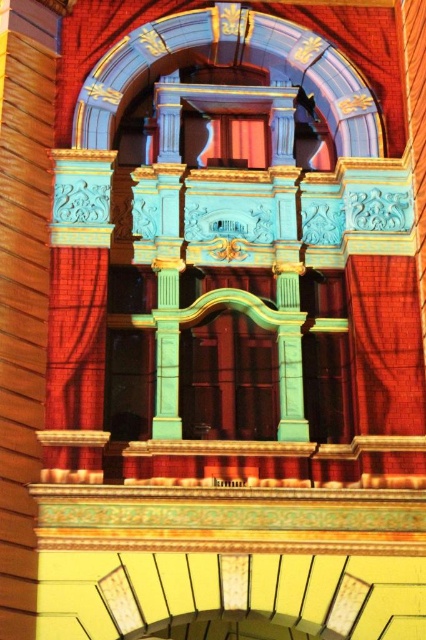
Is velvet red curtain at left smaller than matte red curtain at center?

No.

Which of these two, velvet red curtain at left or matte red curtain at center, stands taller?

velvet red curtain at left is taller.

Image resolution: width=426 pixels, height=640 pixels. What do you see at coordinates (75, 339) in the screenshot?
I see `velvet red curtain at left` at bounding box center [75, 339].

The height and width of the screenshot is (640, 426). Identify the location of velvet red curtain at left. (75, 339).

Is smooth red brick column at center shorter than matte red curtain at center?

Incorrect, smooth red brick column at center's height does not fall short of matte red curtain at center's.

Which is more to the left, smooth red brick column at center or matte red curtain at center?

From the viewer's perspective, smooth red brick column at center appears more on the left side.

The height and width of the screenshot is (640, 426). I want to click on smooth red brick column at center, so click(23, 289).

Between point (29, 566) and point (48, 417), which one is positioned behind?

Point (48, 417)

This screenshot has height=640, width=426. I want to click on smooth red brick column at center, so click(x=23, y=289).

Locate an element on the screen. smooth red brick column at center is located at coordinates (23, 289).